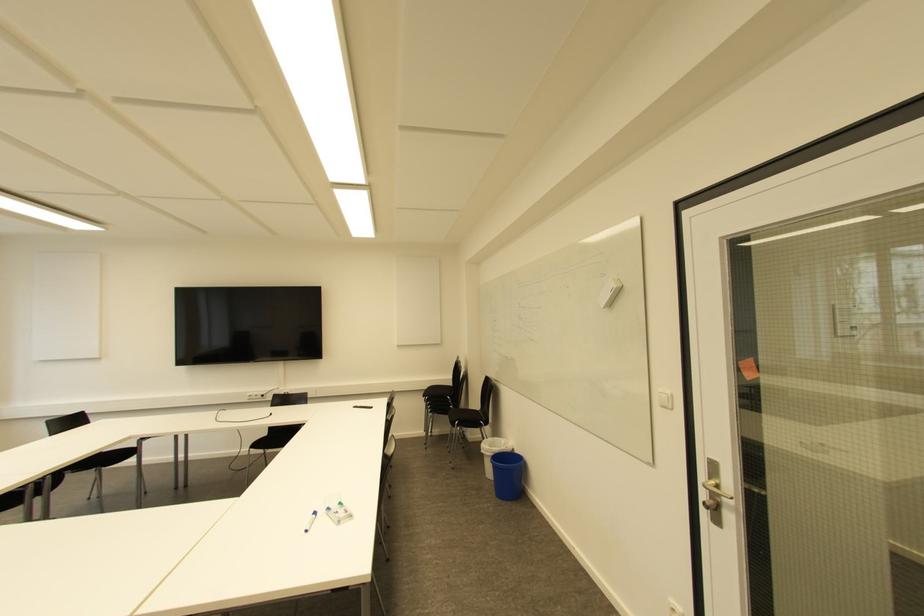
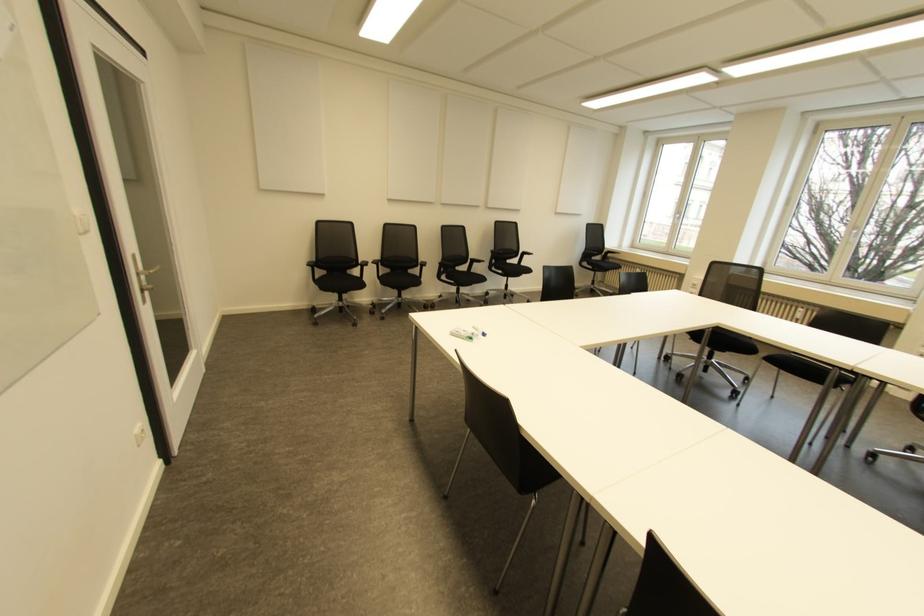
Locate, in the second image, the point that corresponds to [339,503] in the first image.

(470, 338)